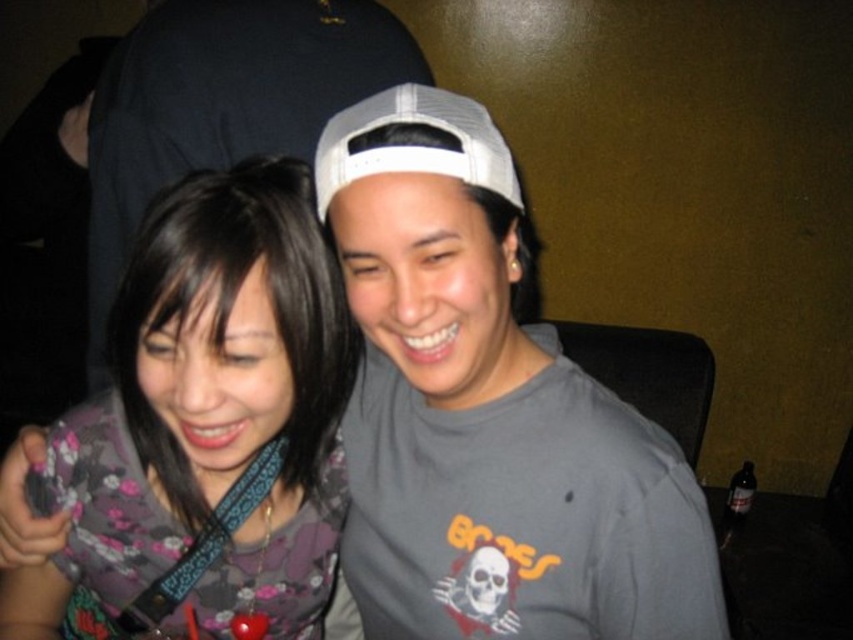
Question: Is floral fabric shirt at center to the left of gray matte t-shirt at center from the viewer's perspective?

Choices:
 (A) no
 (B) yes

Answer: (A)

Question: Is matte gray t-shirt at center below floral fabric shirt at center?

Choices:
 (A) yes
 (B) no

Answer: (B)

Question: Among these points, which one is nearest to the camera?

Choices:
 (A) (424, 401)
 (B) (268, 396)
 (C) (161, 68)

Answer: (B)

Question: Is floral fabric shirt at center positioned at the back of gray matte t-shirt at center?

Choices:
 (A) no
 (B) yes

Answer: (A)

Question: Which point is farther to the camera?

Choices:
 (A) floral fabric shirt at center
 (B) matte gray t-shirt at center

Answer: (A)

Question: Which point is farther to the camera?

Choices:
 (A) (607, 508)
 (B) (265, 145)

Answer: (B)